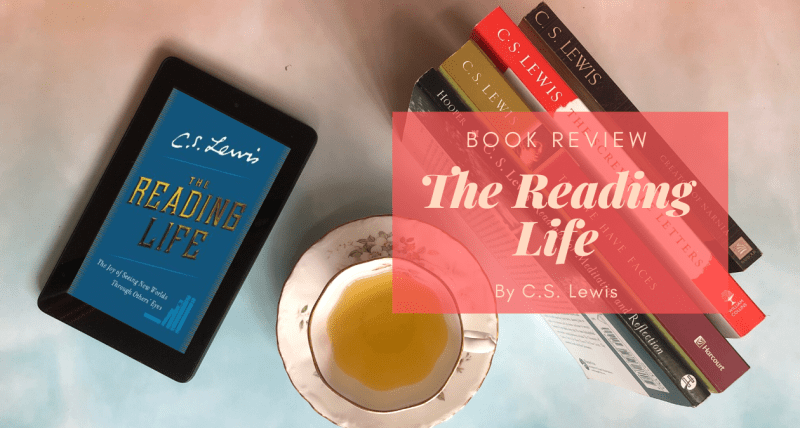
Where is `leaf design on saucer`? The image size is (800, 428). leaf design on saucer is located at coordinates (465, 359), (368, 249), (301, 315), (442, 396), (382, 233).